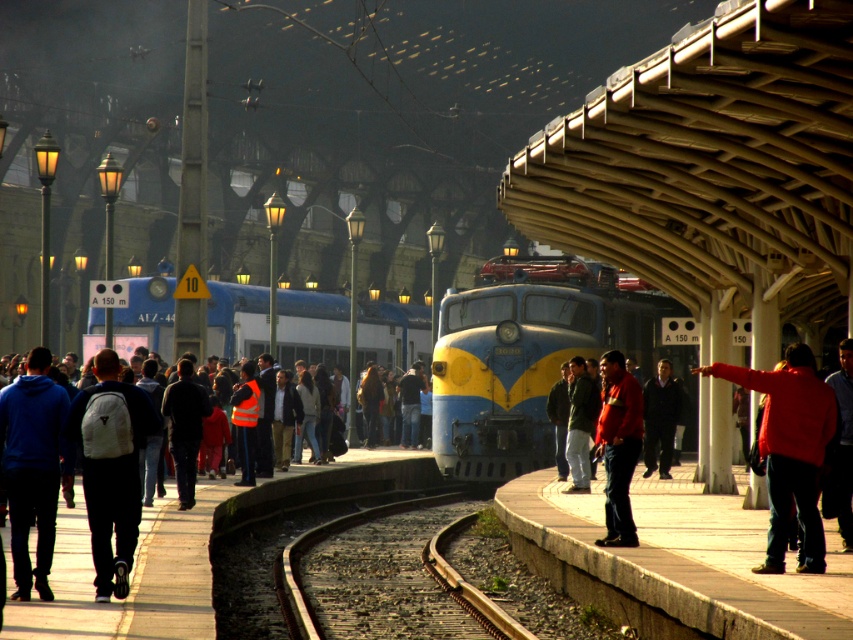
Does blue/yellow painted locomotive at center appear on the left side of brown gravel train track at center?

No, blue/yellow painted locomotive at center is not to the left of brown gravel train track at center.

Who is more forward, (466, 369) or (454, 499)?

Point (466, 369) is more forward.

You are a GUI agent. You are given a task and a screenshot of the screen. Output one action in this format:
    pyautogui.click(x=<x>, y=<y>)
    Task: Click on the blue/yellow painted locomotive at center
    The width and height of the screenshot is (853, 640).
    Given the screenshot: What is the action you would take?
    pyautogui.click(x=526, y=355)

You are a GUI agent. You are given a task and a screenshot of the screen. Output one action in this format:
    pyautogui.click(x=<x>, y=<y>)
    Task: Click on the concrete platform at center
    
    Given the screenshot: What is the action you would take?
    pyautogui.click(x=648, y=577)

Is point (532, 536) behind point (224, 352)?

No, it is not.

You are a GUI agent. You are given a task and a screenshot of the screen. Output one action in this format:
    pyautogui.click(x=<x>, y=<y>)
    Task: Click on the concrete platform at center
    The image size is (853, 640).
    Given the screenshot: What is the action you would take?
    pyautogui.click(x=648, y=577)

Consider the image. Who is positioned more to the left, blue/yellow painted train at center or brown gravel train track at center?

blue/yellow painted train at center is more to the left.

Does blue/yellow painted train at center appear on the right side of brown gravel train track at center?

In fact, blue/yellow painted train at center is to the left of brown gravel train track at center.

I want to click on blue/yellow painted train at center, so click(x=312, y=328).

The height and width of the screenshot is (640, 853). Find the location of `blue/yellow painted train at center`. blue/yellow painted train at center is located at coordinates (312, 328).